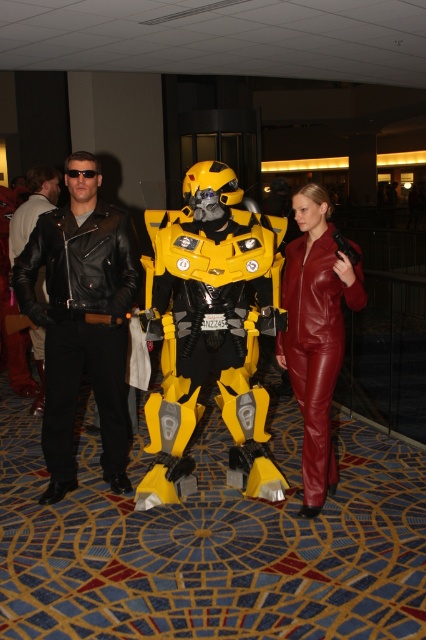
Does yellow matte robot at center have a greater height compared to leather suit at center?

Yes, yellow matte robot at center is taller than leather suit at center.

Does point (178, 444) come behind point (325, 244)?

No.

Is point (271, 474) behind point (353, 244)?

Yes.

At what (x,y) coordinates should I click in order to perform the action: click on yellow matte robot at center. Please return your answer as a coordinate pair (x, y). Image resolution: width=426 pixels, height=640 pixels. Looking at the image, I should click on (210, 332).

Does point (305, 272) lie behind point (40, 403)?

No, (305, 272) is in front of (40, 403).

Who is more distant from viewer, (305, 429) or (32, 173)?

Point (32, 173)

Between point (310, 515) and point (40, 340), which one is positioned behind?

Positioned behind is point (40, 340).

Image resolution: width=426 pixels, height=640 pixels. I want to click on leather suit at center, so click(316, 333).

Who is higher up, yellow matte robot at center or leather jacket at left?

leather jacket at left is above.

Measure the distance between yellow matte robot at center and camera.

yellow matte robot at center and camera are 2.67 meters apart from each other.

Image resolution: width=426 pixels, height=640 pixels. What do you see at coordinates (210, 332) in the screenshot?
I see `yellow matte robot at center` at bounding box center [210, 332].

The image size is (426, 640). In order to click on yellow matte robot at center in this screenshot , I will do `click(210, 332)`.